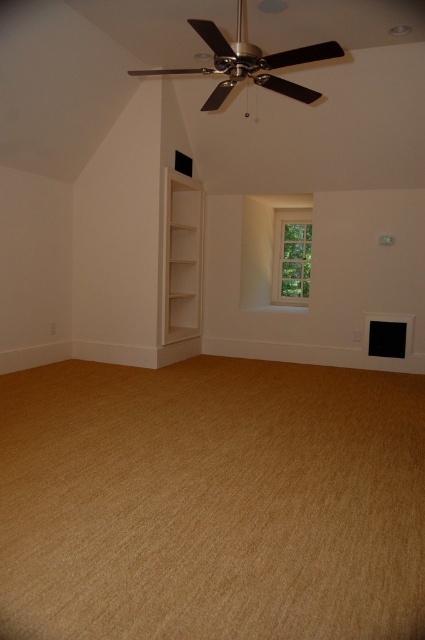
Consider the image. You are moving a 1.5 meter wide sofa into the room and need to place it between the white wood bookshelf at lower left and the clear glass window at center. Is there enough space for the sofa?

The white wood bookshelf at lower left is positioned on the left side of clear glass window at center, so the distance between them is not specified. However, since the sofa is 1.5 meters wide, it would require at least that much space between the two objects. Without knowing the exact distance, it is impossible to confirm if there is enough space.

You are moving a 5.5 feet wide sofa into this room. The sofa needs to be placed between the white wood bookshelf at lower left and the clear glass window at center. Can the sofa fit in that space?

The distance between the white wood bookshelf at lower left and the clear glass window at center is 5.36 feet. Since the sofa is 5.5 feet wide, it cannot fit in the space between them as the required space is slightly narrower than the sofa.

You are standing in the center of the room. You need to place a new plant pot that is 0.3 meters in diameter. The plant pot must be placed exactly at the coordinates given for the white wood bookshelf at lower left. Is there enough space to place the plant pot there without overlapping the bookshelf?

The white wood bookshelf at lower left is located at coordinates point [181,257]. Since the plant pot has a diameter of 0.3 meters, it would require a space of at least 0.3 meters in diameter. However, the exact dimensions of the bookshelf are not provided, so it is uncertain if there is enough space to place the plant pot without overlapping. Additional information about the bookshelf dimensions is needed to determine this.